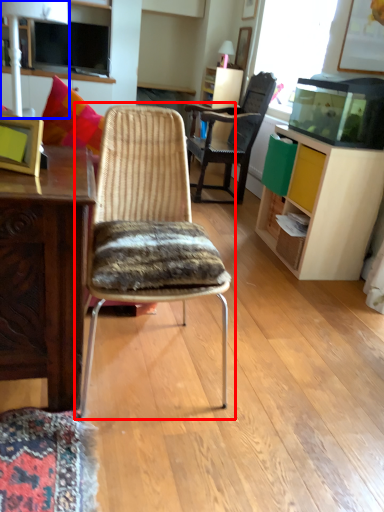
Question: Which point is further to the camera, chair (highlighted by a red box) or lamp (highlighted by a blue box)?

Choices:
 (A) chair
 (B) lamp

Answer: (B)